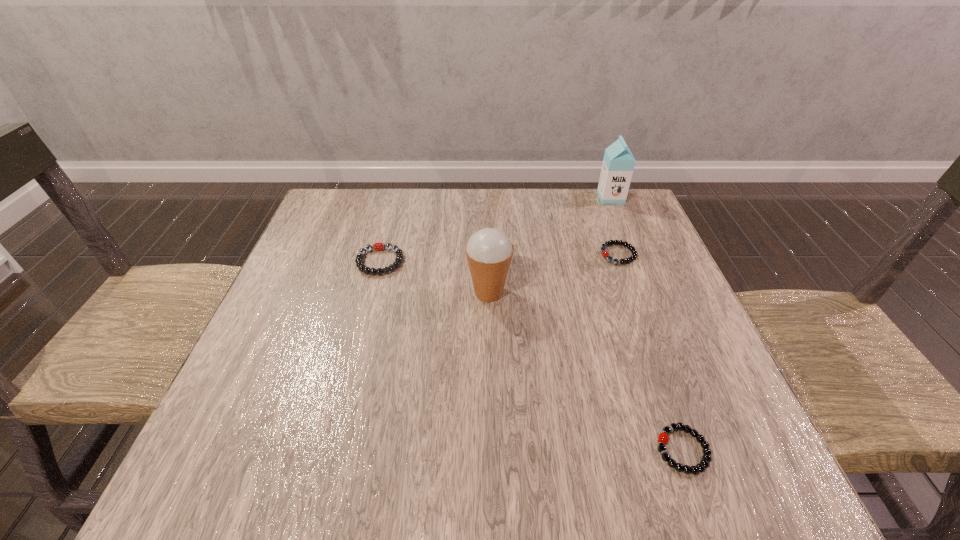
Locate an element on the screen. The width and height of the screenshot is (960, 540). free region at the far left corner of the desktop is located at coordinates (377, 189).

Find the location of a particular element. The width and height of the screenshot is (960, 540). vacant region at the near left corner of the desktop is located at coordinates (202, 467).

Locate an element on the screen. The width and height of the screenshot is (960, 540). free region at the far right corner of the desktop is located at coordinates (595, 193).

This screenshot has width=960, height=540. What are the coordinates of `free space between the second object from left to right and the nearest object` in the screenshot? It's located at (586, 372).

Locate an element on the screen. free space between the nearest object and the milk carton is located at coordinates (x=647, y=323).

Find the location of a particular element. The image size is (960, 540). free space between the milk carton and the second nearest object is located at coordinates (550, 245).

Locate an element on the screen. Image resolution: width=960 pixels, height=540 pixels. empty location between the fourth farthest object and the nearest bracelet is located at coordinates (586, 372).

The width and height of the screenshot is (960, 540). Find the location of `vacant space that's between the farthest object and the nearest bracelet`. vacant space that's between the farthest object and the nearest bracelet is located at coordinates (x=647, y=323).

I want to click on empty space that is in between the icecream and the nearest object, so click(586, 372).

At what (x,y) coordinates should I click in order to perform the action: click on empty space between the nearest object and the farthest object. Please return your answer as a coordinate pair (x, y). Looking at the image, I should click on (647, 323).